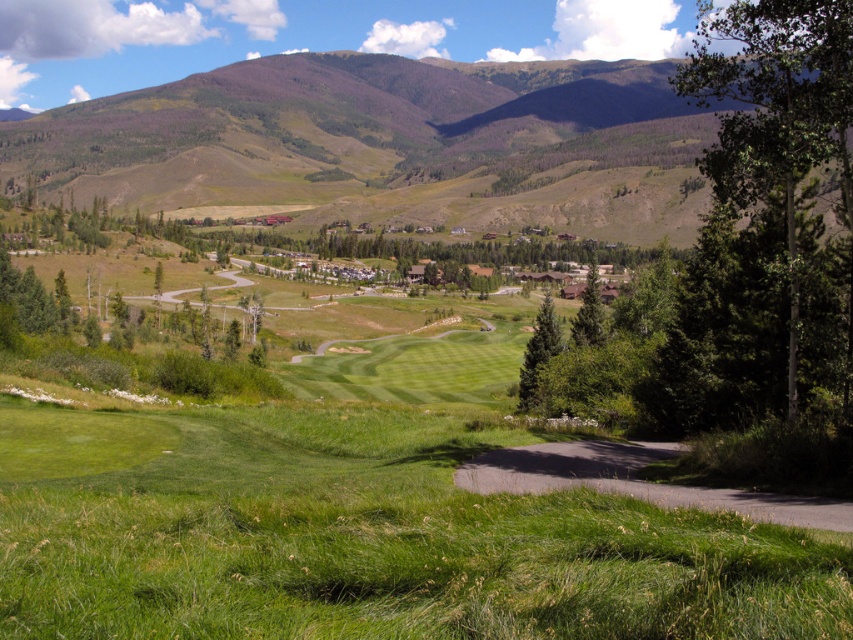
Question: Does green grassy golf course at center have a larger size compared to green matte tree at center-right?

Choices:
 (A) yes
 (B) no

Answer: (B)

Question: Based on their relative distances, which object is farther from the green matte tree at center-right?

Choices:
 (A) green grassy mountain at upper center
 (B) green textured tree at center-right
 (C) green grassy golf course at center

Answer: (A)

Question: Is the position of green grassy mountain at upper center more distant than that of green leafy tree at right?

Choices:
 (A) no
 (B) yes

Answer: (B)

Question: Based on their relative distances, which object is nearer to the green textured tree at center-right?

Choices:
 (A) green grassy golf course at center
 (B) green matte tree at center-right
 (C) green leafy tree at right

Answer: (B)

Question: Which object appears closest to the camera in this image?

Choices:
 (A) green grassy golf course at center
 (B) green matte tree at center-right
 (C) green leafy tree at right
 (D) green grassy mountain at upper center

Answer: (A)

Question: Can you confirm if green grassy golf course at center is positioned to the right of green matte tree at center-right?

Choices:
 (A) yes
 (B) no

Answer: (B)